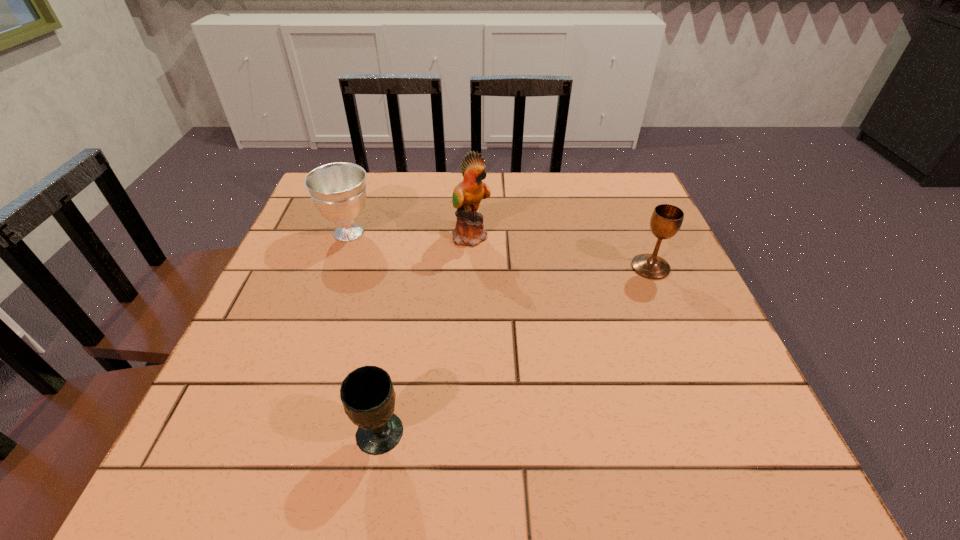
Image resolution: width=960 pixels, height=540 pixels. I want to click on the second object from right to left, so click(x=469, y=231).

The height and width of the screenshot is (540, 960). Identify the location of the tallest object. (469, 231).

Where is `the farthest chalice`? the farthest chalice is located at coordinates (338, 190).

I want to click on the leftmost chalice, so coord(338,190).

Where is `the rightmost object`? the rightmost object is located at coordinates (666, 220).

The height and width of the screenshot is (540, 960). In order to click on the third farthest object in this screenshot , I will do `click(666, 220)`.

At what (x,y) coordinates should I click in order to perform the action: click on the nearest object. Please return your answer as a coordinate pair (x, y). Looking at the image, I should click on (367, 394).

Locate an element on the screen. This screenshot has width=960, height=540. the nearest chalice is located at coordinates (367, 394).

Locate an element on the screen. This screenshot has width=960, height=540. vacant space located on the front-facing side of the tallest object is located at coordinates (618, 236).

Find the location of a particular element. The image size is (960, 540). vacant space located 0.390m on the front of the leftmost chalice is located at coordinates (293, 391).